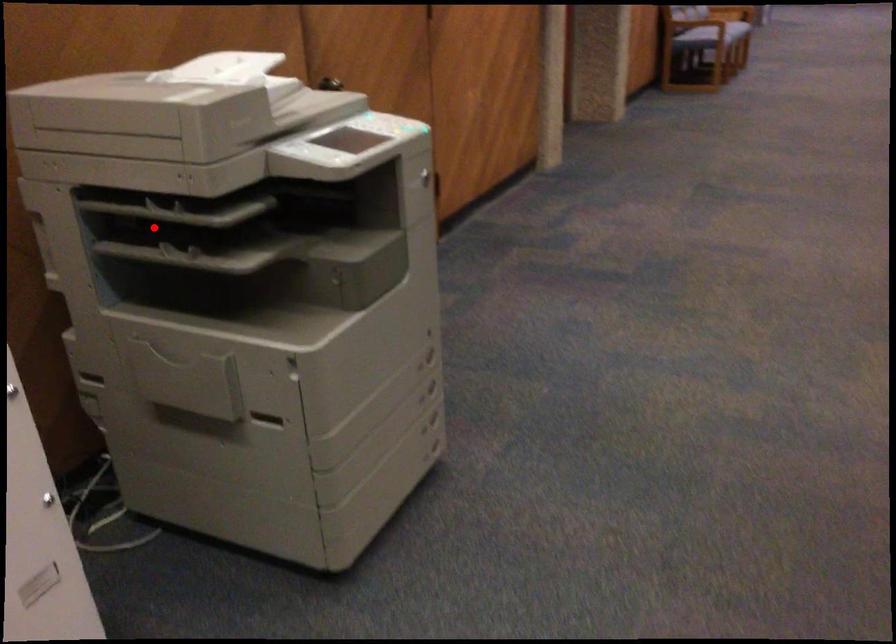
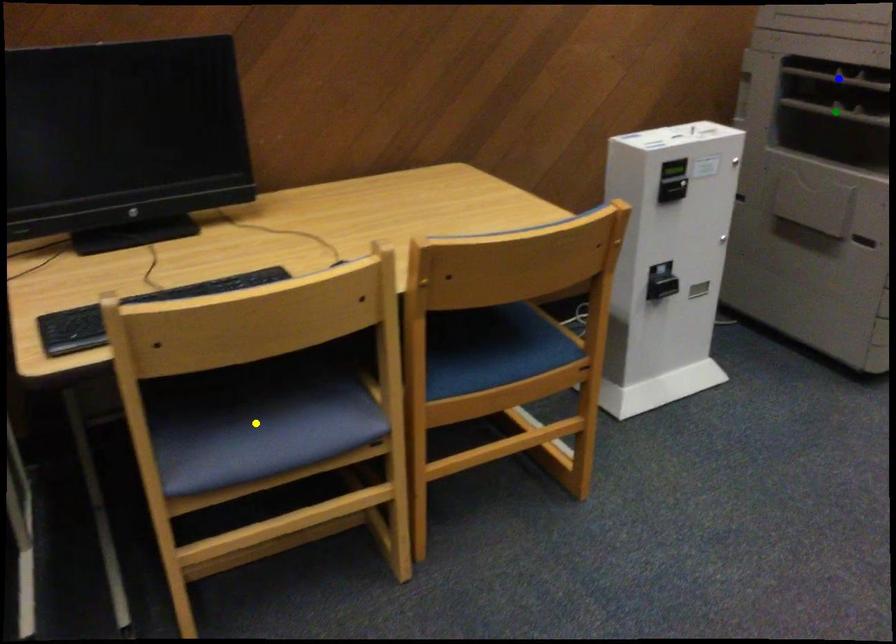
Question: I am providing you with two images of the same scene from different viewpoints. A red point is marked on the first image. You are given multiple points on the second image. Which mark in image 2 goes with the point in image 1?

Choices:
 (A) blue point
 (B) yellow point
 (C) green point

Answer: (A)